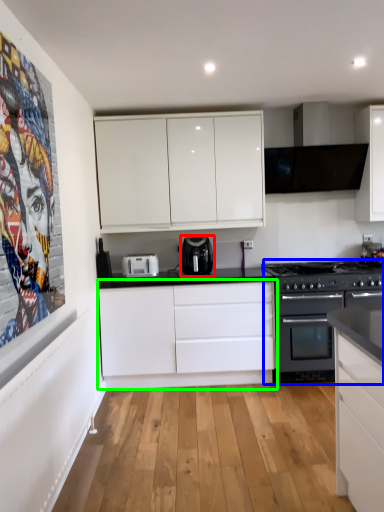
Question: Which object is positioned closest to kitchen appliance (highlighted by a red box)? Select from appliance (highlighted by a blue box) and cabinetry (highlighted by a green box).

Choices:
 (A) appliance
 (B) cabinetry

Answer: (B)